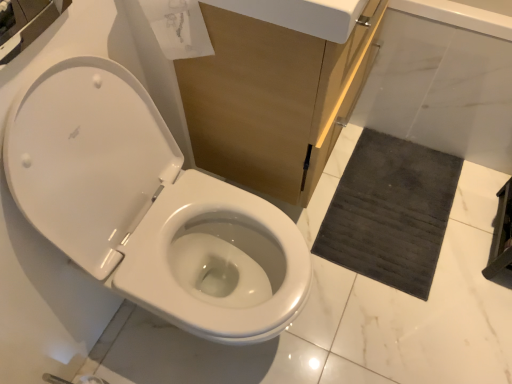
Where is `free location in front of matte wood cabinet at center`? The height and width of the screenshot is (384, 512). free location in front of matte wood cabinet at center is located at coordinates (359, 283).